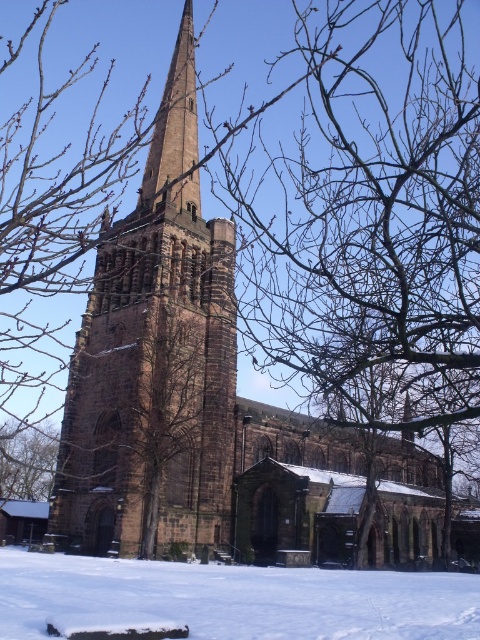
Question: Can you confirm if brown stone tower at center is positioned below brown textured tree at lower left?

Choices:
 (A) no
 (B) yes

Answer: (A)

Question: Is brown stone tower at center closer to the viewer compared to brown textured tree at lower left?

Choices:
 (A) no
 (B) yes

Answer: (B)

Question: Which of these objects is positioned closest to the brown stone tower at center?

Choices:
 (A) white powdery snow at lower center
 (B) brown textured tree at lower left

Answer: (A)

Question: Which object appears farthest from the camera in this image?

Choices:
 (A) white powdery snow at lower center
 (B) brown stone tower at center

Answer: (B)

Question: Which point appears closest to the camera in this image?

Choices:
 (A) (187, 109)
 (B) (12, 492)
 (C) (255, 628)

Answer: (C)

Question: Does brown stone tower at center have a greater width compared to white powdery snow at lower center?

Choices:
 (A) yes
 (B) no

Answer: (B)